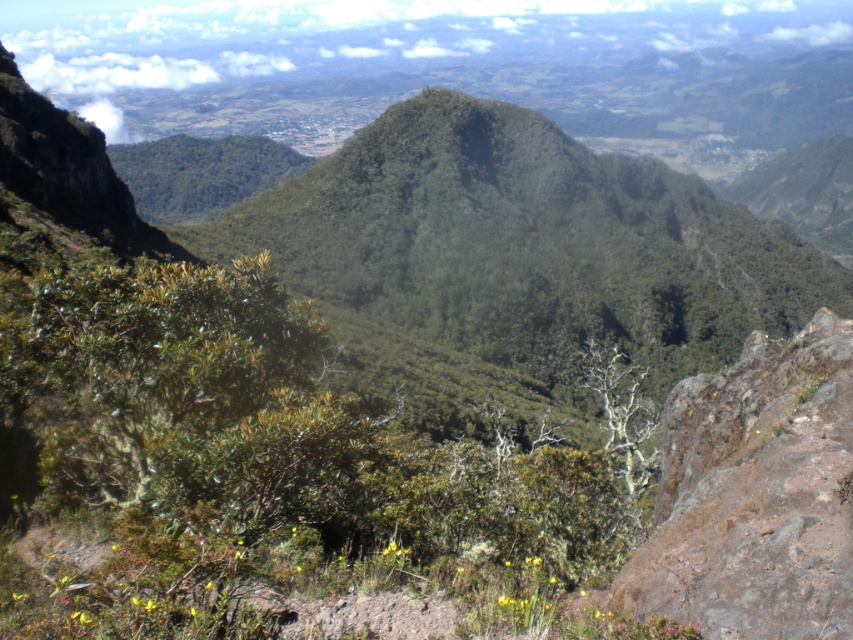
Is green leafy shrub at center behind brown rough rock at right?

No, green leafy shrub at center is closer to the viewer.

Looking at this image, does green leafy shrub at center appear on the right side of brown rough rock at right?

No, green leafy shrub at center is not to the right of brown rough rock at right.

The width and height of the screenshot is (853, 640). Describe the element at coordinates (254, 467) in the screenshot. I see `green leafy shrub at center` at that location.

At what (x,y) coordinates should I click in order to perform the action: click on green leafy shrub at center. Please return your answer as a coordinate pair (x, y). This screenshot has width=853, height=640. Looking at the image, I should click on (254, 467).